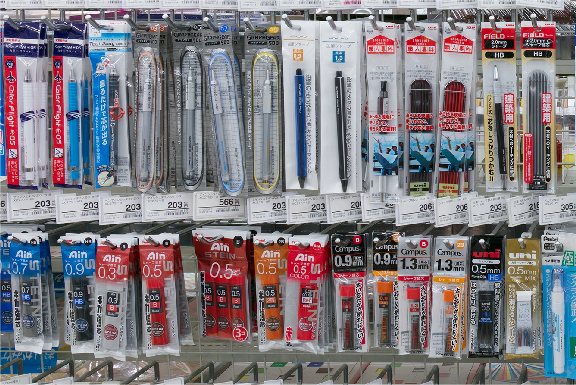
In order to click on metal shelving unit in this screenshot , I will do `click(189, 353)`, `click(219, 353)`, `click(314, 359)`.